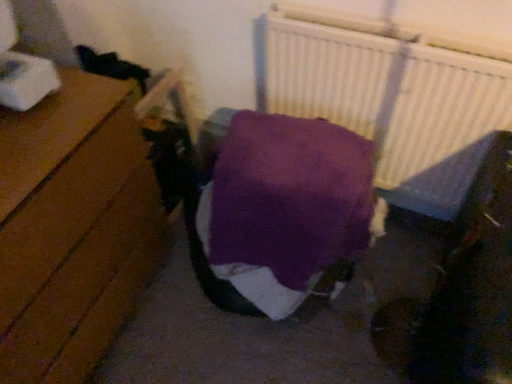
Question: From a real-world perspective, is white textured radiator at upper right physically located above or below purple soft blanket at center?

Choices:
 (A) below
 (B) above

Answer: (B)

Question: Considering the positions of white textured radiator at upper right and purple soft blanket at center in the image, is white textured radiator at upper right taller or shorter than purple soft blanket at center?

Choices:
 (A) tall
 (B) short

Answer: (A)

Question: Which of these objects is positioned farthest from the wooden floor at left?

Choices:
 (A) purple soft blanket at center
 (B) white textured radiator at upper right

Answer: (B)

Question: Estimate the real-world distances between objects in this image. Which object is closer to the white textured radiator at upper right?

Choices:
 (A) wooden floor at left
 (B) purple soft blanket at center

Answer: (B)